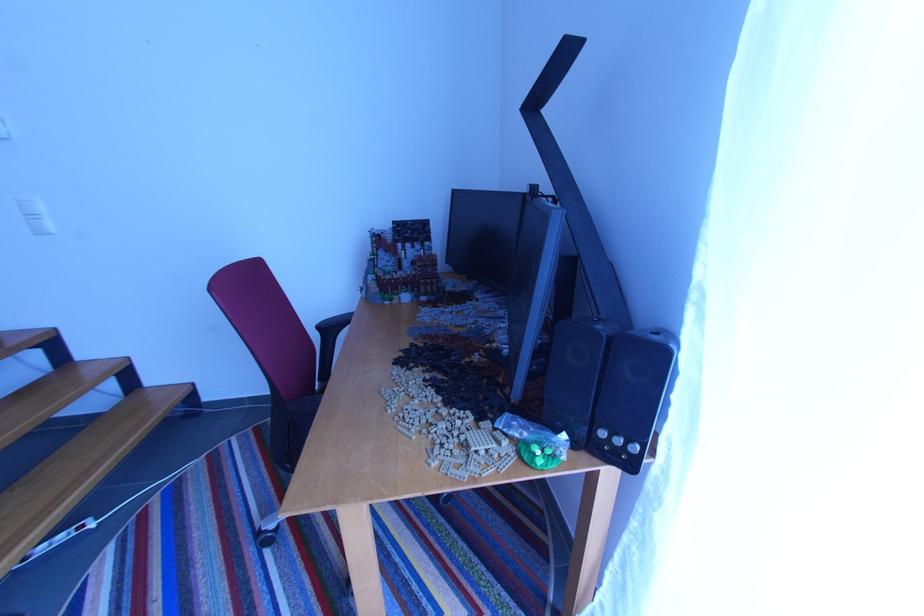
Where is `black chair armrest`? black chair armrest is located at coordinates (333, 325).